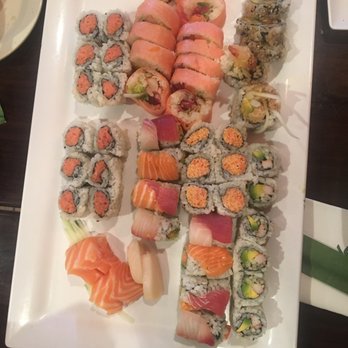
I want to click on table, so click(x=16, y=75), click(x=13, y=198), click(x=322, y=176), click(x=326, y=135).